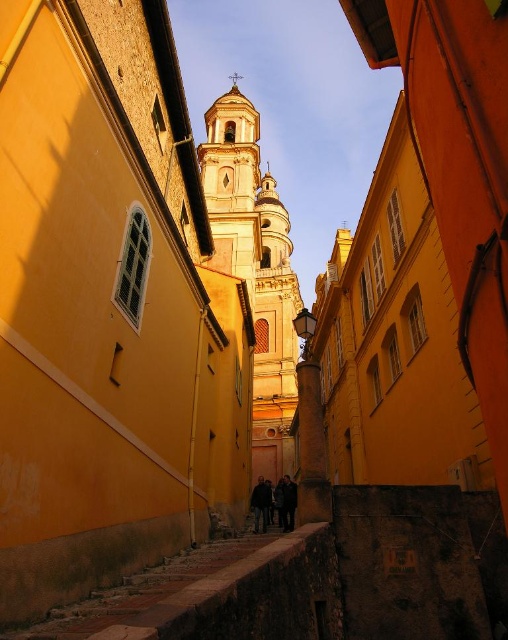
Consider the image. You are standing on the narrow street looking up at the smooth gold tower at center and the dark clothing figure at center. Which object is positioned to the left?

The smooth gold tower at center is to the left of the dark clothing figure at center.

You are a tourist standing on the narrow street looking up at the bell tower. You notice a dark gray fabric coat at center and dark blue jeans at center. Which item is closer to you?

The dark gray fabric coat at center is closer to you because it is in front of the dark blue jeans at center.

You are standing on the narrow street looking up at the bell tower. There are two points marked on the image. The first point is at coordinates point [263,513] and the second point is at point [267,486]. Which point is closer to you?

Point [263,513] is closer to the camera than point [267,486].